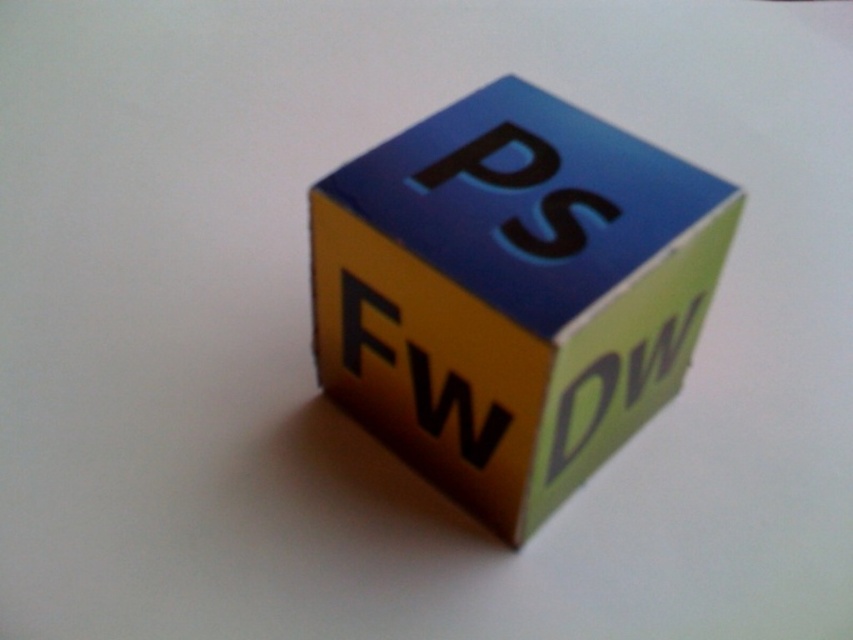
You are a GUI agent. You are given a task and a screenshot of the screen. Output one action in this format:
    pyautogui.click(x=<x>, y=<y>)
    Task: Click on the matte plastic cube at center
    
    Given the screenshot: What is the action you would take?
    pyautogui.click(x=515, y=292)

Between matte plastic cube at center and blue matte letter at upper center, which one appears on the left side from the viewer's perspective?

Positioned to the left is blue matte letter at upper center.

At what (x,y) coordinates should I click in order to perform the action: click on matte plastic cube at center. Please return your answer as a coordinate pair (x, y). The height and width of the screenshot is (640, 853). Looking at the image, I should click on (515, 292).

Describe the element at coordinates (494, 161) in the screenshot. I see `blue matte letter at upper center` at that location.

Who is shorter, blue matte letter at upper center or green matte/dw at center?

Standing shorter between the two is green matte/dw at center.

You are a GUI agent. You are given a task and a screenshot of the screen. Output one action in this format:
    pyautogui.click(x=<x>, y=<y>)
    Task: Click on the blue matte letter at upper center
    
    Given the screenshot: What is the action you would take?
    pyautogui.click(x=494, y=161)

Does blue matte letter at upper center have a greater height compared to matte yellow letter at center?

Indeed, blue matte letter at upper center has a greater height compared to matte yellow letter at center.

Measure the distance between blue matte letter at upper center and camera.

1.18 meters

Where is `blue matte letter at upper center`? This screenshot has height=640, width=853. blue matte letter at upper center is located at coordinates (494, 161).